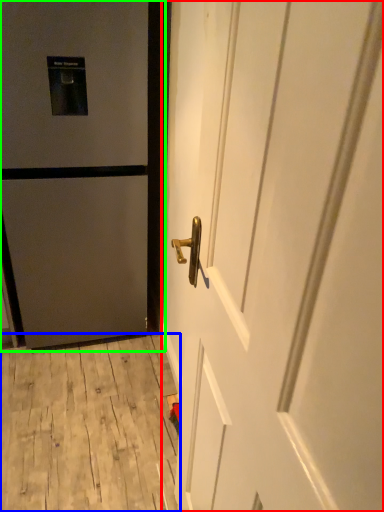
Question: Estimate the real-world distances between objects in this image. Which object is farther from door (highlighted by a red box), plywood (highlighted by a blue box) or door (highlighted by a green box)?

Choices:
 (A) plywood
 (B) door

Answer: (A)